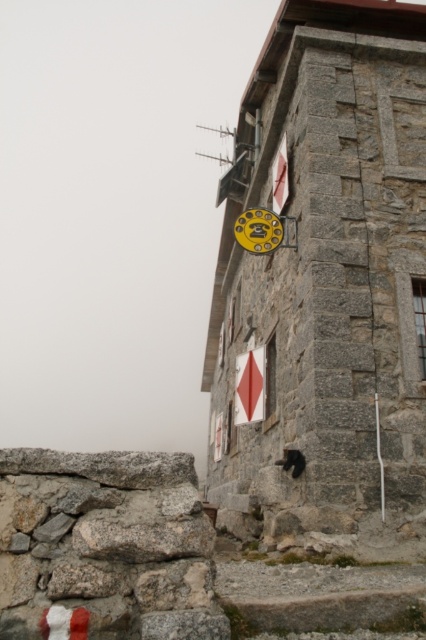
Which is more to the left, stone textured tower at center or white matte sign at upper center?

stone textured tower at center

In the scene shown: How much distance is there between stone textured tower at center and white matte sign at upper center?

stone textured tower at center is 12.49 meters from white matte sign at upper center.

Image resolution: width=426 pixels, height=640 pixels. In order to click on stone textured tower at center in this screenshot , I will do `click(325, 280)`.

This screenshot has width=426, height=640. What do you see at coordinates (104, 547) in the screenshot?
I see `gray rough stone at lower left` at bounding box center [104, 547].

Is gray rough stone at lower left below red plastic diamond at center?

Correct, gray rough stone at lower left is located below red plastic diamond at center.

Between point (81, 483) and point (250, 401), which one is positioned behind?

The point (250, 401) is more distant.

Locate an element on the screen. The width and height of the screenshot is (426, 640). gray rough stone at lower left is located at coordinates (104, 547).

Between red plastic diamond at center and white matte sign at upper center, which one is positioned lower?

Positioned lower is red plastic diamond at center.

Can you confirm if red plastic diamond at center is taller than white matte sign at upper center?

Correct, red plastic diamond at center is much taller as white matte sign at upper center.

Where is `red plastic diamond at center`? The height and width of the screenshot is (640, 426). red plastic diamond at center is located at coordinates (250, 387).